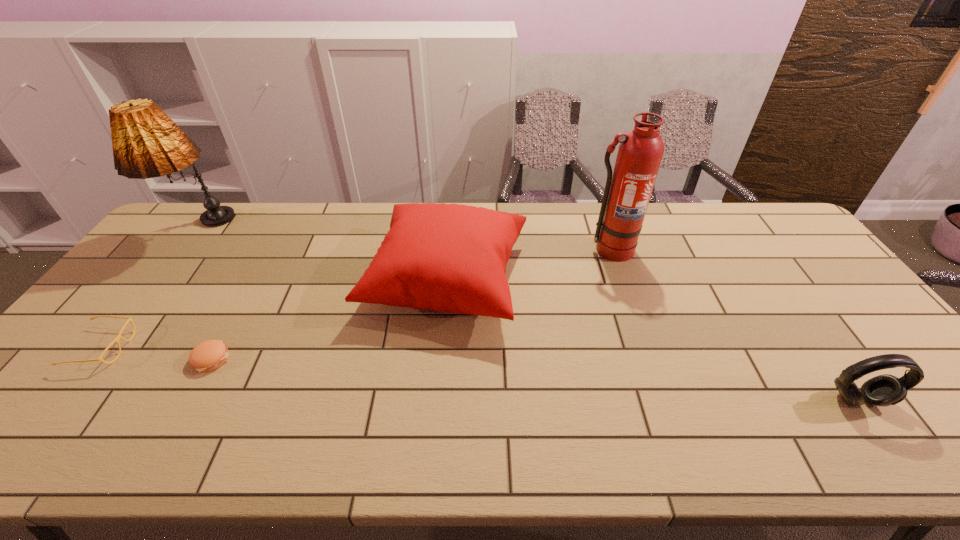
Locate an element on the screen. Image resolution: width=960 pixels, height=540 pixels. free space located 0.140m on the back of the third tallest object is located at coordinates (453, 207).

Find the location of a particular element. This screenshot has width=960, height=540. vacant space located 0.090m on the earcups of the nearest object is located at coordinates (893, 450).

Identify the location of free region located in front of the lenses of the spectacles. The width and height of the screenshot is (960, 540). (247, 348).

Find the location of a particular element. vacant space located 0.230m on the right of the patty is located at coordinates (324, 359).

The height and width of the screenshot is (540, 960). I want to click on lampshade that is at the far edge, so click(x=146, y=143).

At what (x,y) coordinates should I click in order to perform the action: click on fire extinguisher located at the far edge. Please return your answer as a coordinate pair (x, y). Looking at the image, I should click on [627, 193].

Where is `cushion that is at the far edge`? cushion that is at the far edge is located at coordinates (451, 258).

In order to click on lampshade that is at the left edge in this screenshot , I will do `click(146, 143)`.

The height and width of the screenshot is (540, 960). Identify the location of spectacles that is at the left edge. point(119,336).

The image size is (960, 540). Identify the location of object that is at the right edge. (884, 390).